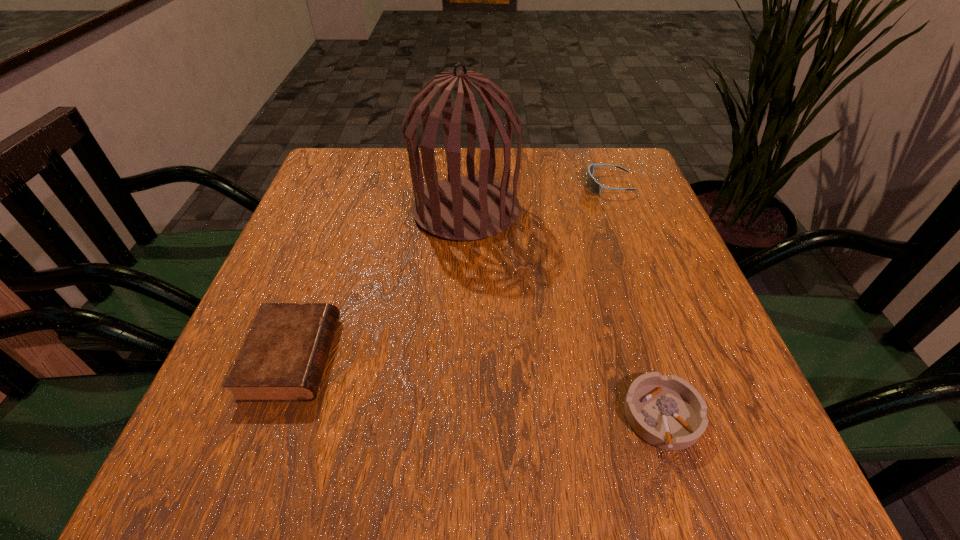
Locate an element on the screen. The height and width of the screenshot is (540, 960). free space that satisfies the following two spatial constraints: 1. on the front side of the birdcage; 2. on the spine side of the diary is located at coordinates (461, 357).

Image resolution: width=960 pixels, height=540 pixels. Find the location of `free spot that satisfies the following two spatial constraints: 1. on the front-facing side of the goggles; 2. on the front side of the ashtray`. free spot that satisfies the following two spatial constraints: 1. on the front-facing side of the goggles; 2. on the front side of the ashtray is located at coordinates (694, 417).